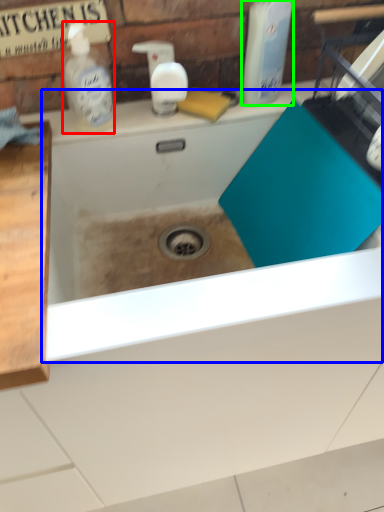
Question: Considering the real-world distances, which object is closest to cleaning product (highlighted by a red box)? bath (highlighted by a blue box) or cleaning product (highlighted by a green box).

Choices:
 (A) bath
 (B) cleaning product

Answer: (A)